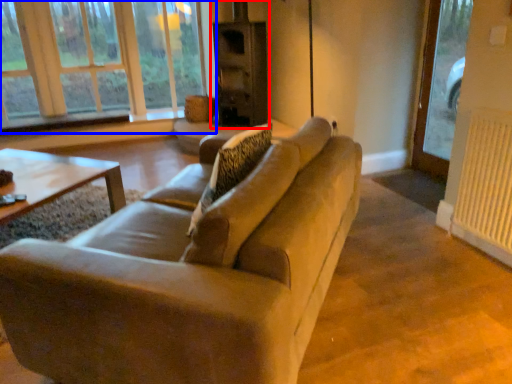
Question: Which object is further to the camera taking this photo, fireplace (highlighted by a red box) or window (highlighted by a blue box)?

Choices:
 (A) fireplace
 (B) window

Answer: (B)